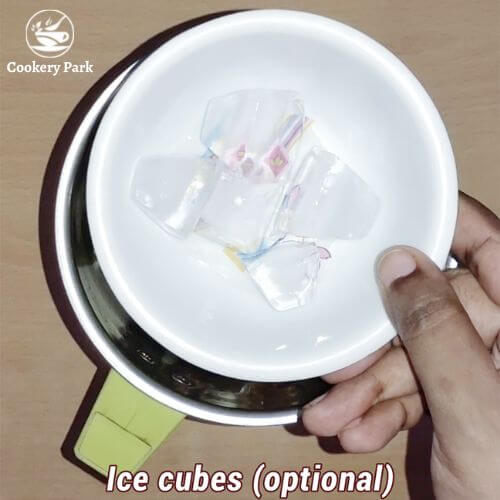
I want to click on handle, so click(x=124, y=387).